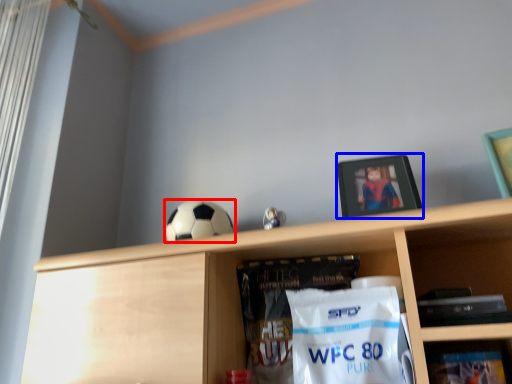
Question: Which object appears closest to the camera in this image, football (highlighted by a red box) or picture frame (highlighted by a blue box)?

Choices:
 (A) football
 (B) picture frame

Answer: (B)